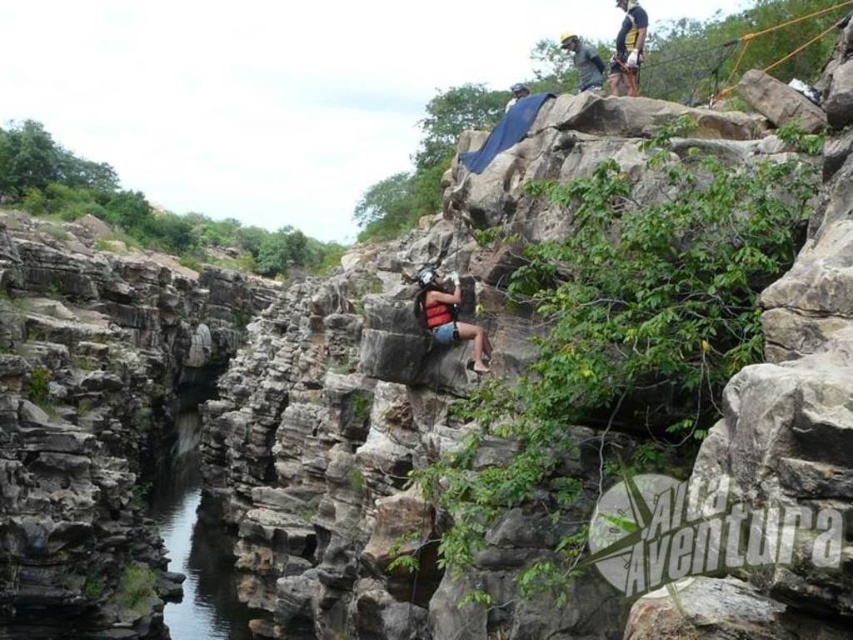
Question: Can you confirm if orange nylon rope bridge at upper right is positioned below matte black helmet at upper center?

Choices:
 (A) no
 (B) yes

Answer: (A)

Question: Can you confirm if matte black helmet at upper center is positioned above gray fabric at upper center?

Choices:
 (A) yes
 (B) no

Answer: (B)

Question: Among these objects, which one is nearest to the camera?

Choices:
 (A) gray fabric at upper center
 (B) orange nylon rope bridge at upper right
 (C) matte red life vest at center
 (D) clear water at center

Answer: (C)

Question: Does orange nylon rope bridge at upper right have a smaller size compared to matte red life vest at center?

Choices:
 (A) no
 (B) yes

Answer: (A)

Question: Which object appears farthest from the camera in this image?

Choices:
 (A) gray fabric at upper center
 (B) clear water at center
 (C) orange nylon rope bridge at upper right

Answer: (B)

Question: Based on their relative distances, which object is nearer to the gray fabric at upper center?

Choices:
 (A) orange nylon rope bridge at upper right
 (B) clear water at center
 (C) matte red life vest at center
 (D) matte black helmet at upper center

Answer: (D)